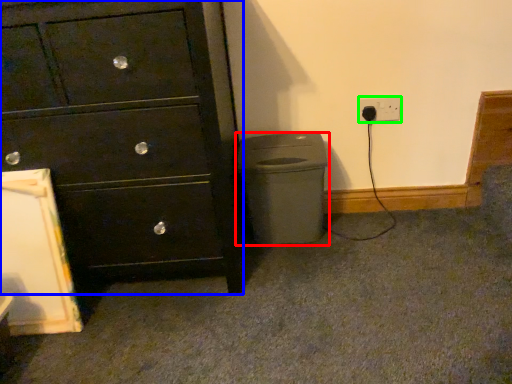
Question: Which is nearer to the waste container (highlighted by a red box)? chest of drawers (highlighted by a blue box) or power plugs and sockets (highlighted by a green box).

Choices:
 (A) chest of drawers
 (B) power plugs and sockets

Answer: (A)